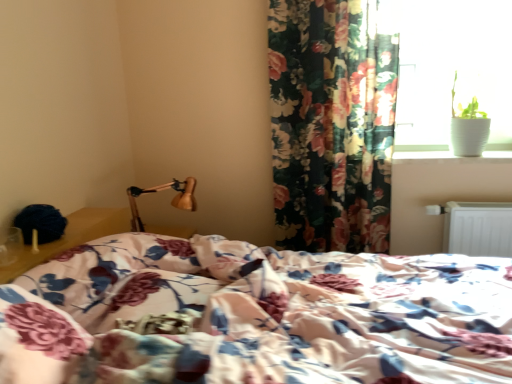
Question: Is wooden lamp at upper left wider or thinner than floral fabric curtain at upper right?

Choices:
 (A) thin
 (B) wide

Answer: (B)

Question: In the image, is wooden lamp at upper left on the left side or the right side of floral fabric curtain at upper right?

Choices:
 (A) right
 (B) left

Answer: (B)

Question: Estimate the real-world distances between objects in this image. Which object is closer to the floral fabric curtain at upper right?

Choices:
 (A) white metallic radiator at lower right
 (B) wooden lamp at upper left
 (C) white ceramic pot at upper right
 (D) white glossy window sill at upper right
 (E) floral fabric bed at center

Answer: (C)

Question: Which object is positioned closest to the white metallic radiator at lower right?

Choices:
 (A) floral fabric bed at center
 (B) white glossy window sill at upper right
 (C) floral fabric curtain at upper right
 (D) white ceramic pot at upper right
 (E) wooden lamp at upper left

Answer: (B)